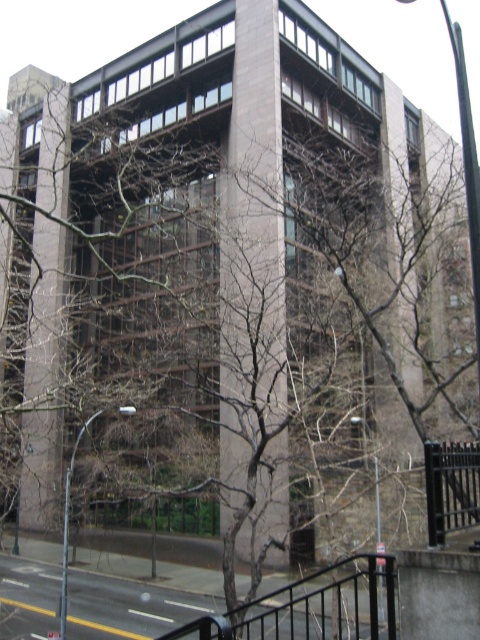
Question: Does black metal/rail at lower right come behind black metal fence at lower right?

Choices:
 (A) yes
 (B) no

Answer: (B)

Question: Is black metal/rail at lower right positioned before black metal fence at lower right?

Choices:
 (A) no
 (B) yes

Answer: (B)

Question: Which object is farther from the camera taking this photo?

Choices:
 (A) black metal/rail at lower right
 (B) black metal fence at lower right

Answer: (B)

Question: Is black metal/rail at lower right to the left of black metal fence at lower right from the viewer's perspective?

Choices:
 (A) no
 (B) yes

Answer: (B)